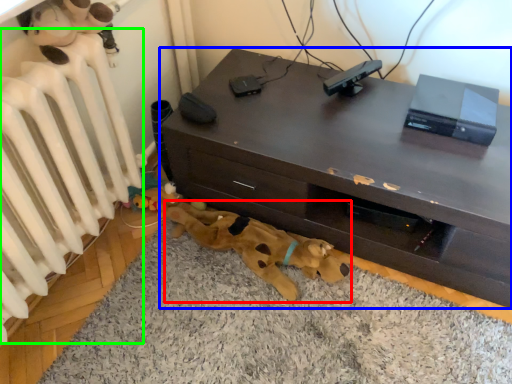
Question: Which object is positioned closest to toy (highlighted by a red box)? Select from desk (highlighted by a blue box) and radiator (highlighted by a green box).

Choices:
 (A) desk
 (B) radiator

Answer: (A)